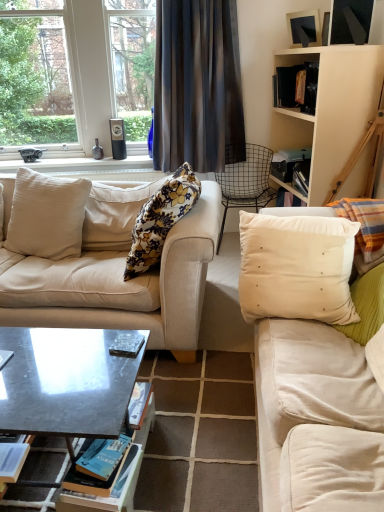
Identify the location of empty space that is to the right of metallic gray book at center, placed as the 2th book when sorted from top to bottom. Image resolution: width=384 pixels, height=512 pixels. (31, 368).